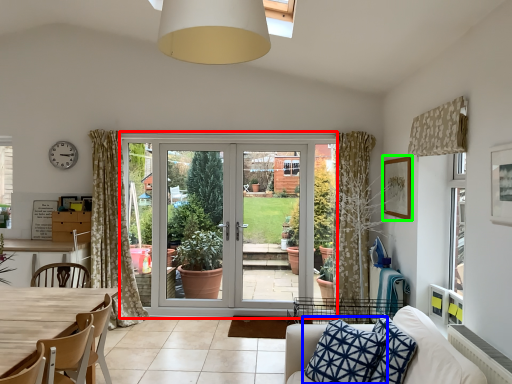
Question: Which object is the closest to the screen door (highlighted by a red box)? Choose among these: pillow (highlighted by a blue box) or picture frame (highlighted by a green box).

Choices:
 (A) pillow
 (B) picture frame

Answer: (B)